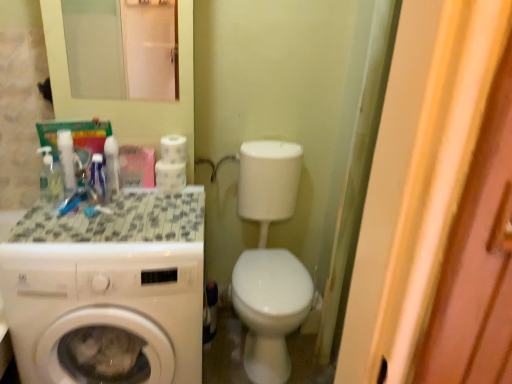
Find the location of a particular element. The image size is (512, 384). free space in front of white glossy mouthwash at upper left, placed as the 1th mouthwash when sorted from right to left is located at coordinates (x=99, y=218).